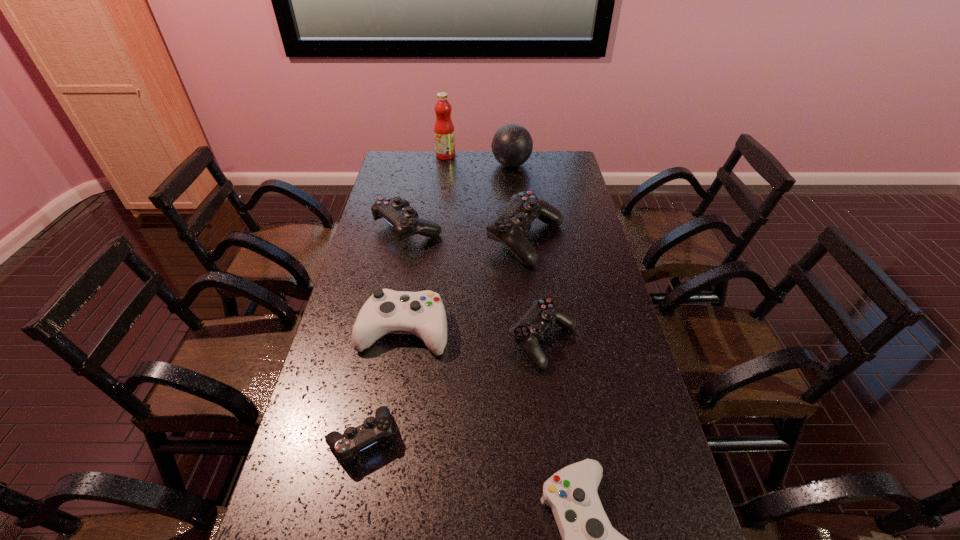
At what (x,y) coordinates should I click in order to perform the action: click on fruit juice at the far edge. Please return your answer as a coordinate pair (x, y). Looking at the image, I should click on (444, 134).

Find the location of a particular element. bowling ball present at the far edge is located at coordinates (512, 145).

Locate an element on the screen. The width and height of the screenshot is (960, 540). free spot at the far edge of the desktop is located at coordinates (534, 176).

The height and width of the screenshot is (540, 960). In the image, there is a desktop. What are the coordinates of `free space at the left edge` in the screenshot? It's located at (365, 276).

In the image, there is a desktop. Where is `vacant region at the right edge`? This screenshot has height=540, width=960. vacant region at the right edge is located at coordinates (675, 502).

Find the location of `free space between the second biggest black control and the farther white control`. free space between the second biggest black control and the farther white control is located at coordinates (406, 279).

I want to click on vacant region between the third smallest black control and the third biggest black control, so click(x=475, y=284).

Image resolution: width=960 pixels, height=540 pixels. What are the coordinates of `empty space between the third biggest black control and the shortest object` in the screenshot? It's located at (452, 390).

Find the location of `free point between the sixth shortest object and the left white control`. free point between the sixth shortest object and the left white control is located at coordinates (465, 285).

Identify the location of free area in between the third biggest black control and the nearest black control. (452, 390).